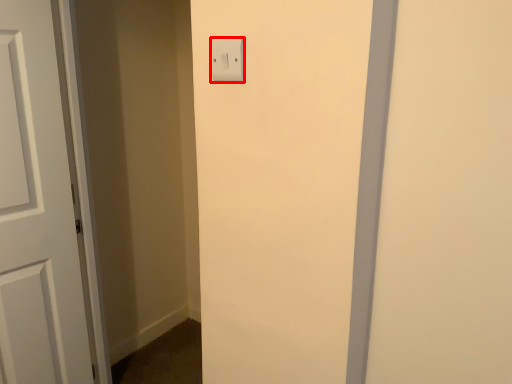
Question: From the image's perspective, where is light switch (annotated by the red box) located in relation to door in the image?

Choices:
 (A) below
 (B) above

Answer: (B)